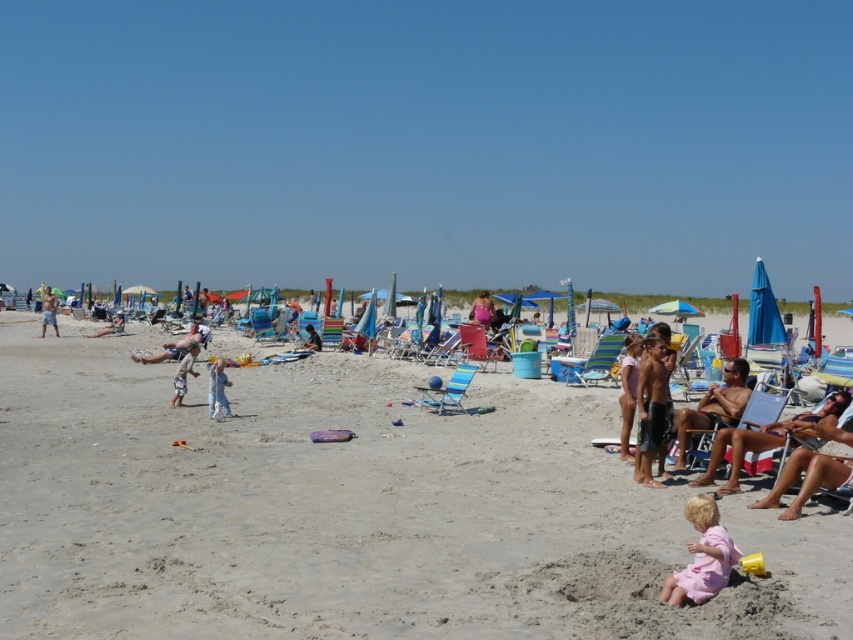
Does wooden beach chair at center have a lesser height compared to matte pink towel at center?

Yes.

Between point (770, 406) and point (202, 339), which one is positioned in front?

Positioned in front is point (770, 406).

Locate an element on the screen. The width and height of the screenshot is (853, 640). wooden beach chair at center is located at coordinates (761, 410).

Is beige sand at center closer to the viewer compared to blue fabric umbrella at right?

Yes.

Does beige sand at center have a smaller size compared to blue fabric umbrella at right?

Correct, beige sand at center occupies less space than blue fabric umbrella at right.

The width and height of the screenshot is (853, 640). What do you see at coordinates (354, 509) in the screenshot?
I see `beige sand at center` at bounding box center [354, 509].

Locate an element on the screen. This screenshot has width=853, height=640. beige sand at center is located at coordinates (354, 509).

Is blue fabric umbrella at right in front of tan cotton shorts at center?

No, blue fabric umbrella at right is behind tan cotton shorts at center.

Which is more to the right, blue fabric umbrella at right or tan cotton shorts at center?

blue fabric umbrella at right

Identify the location of blue fabric umbrella at right. (763, 310).